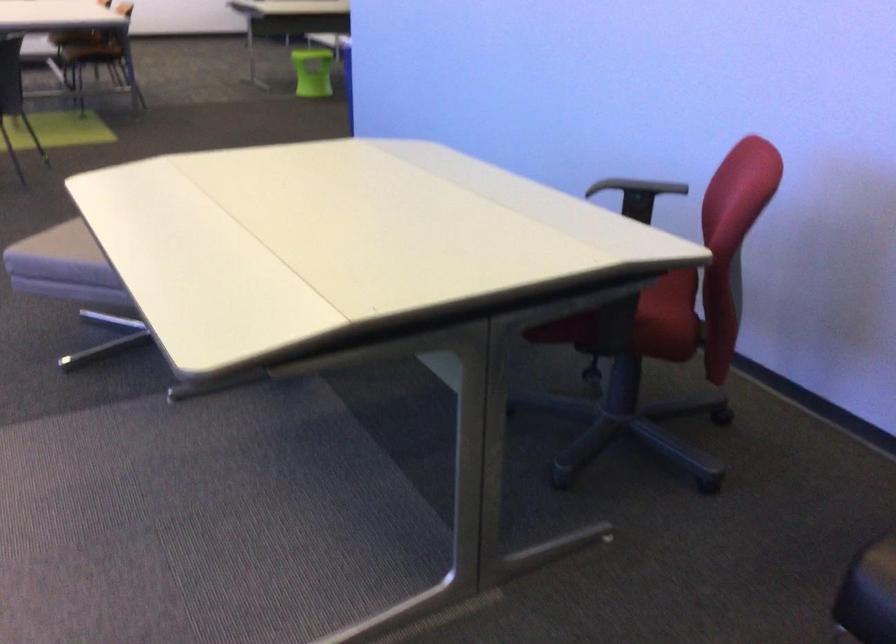
Find the location of a particular element. red chair sitting surface is located at coordinates (669, 299).